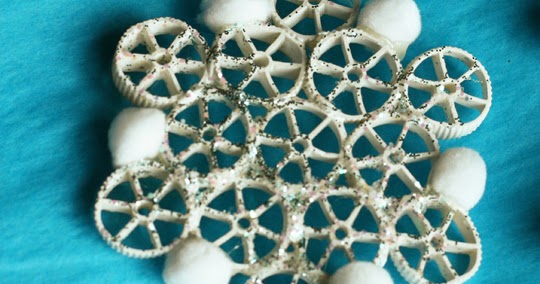
Locate an element on the screen. This screenshot has height=284, width=540. blue fabric is located at coordinates (60, 130), (508, 142).